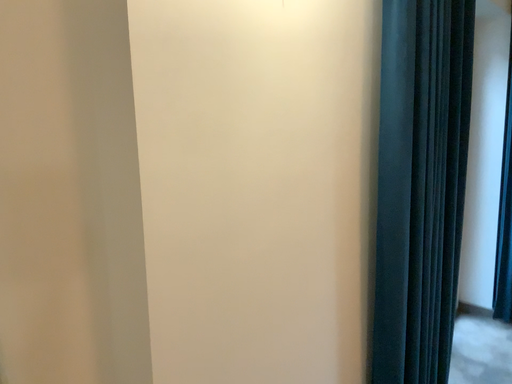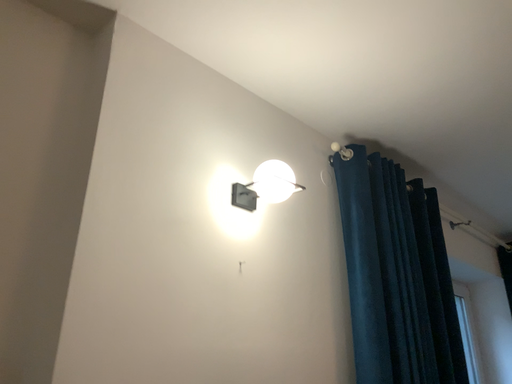
Question: How did the camera likely rotate when shooting the video?

Choices:
 (A) rotated downward
 (B) rotated upward

Answer: (B)